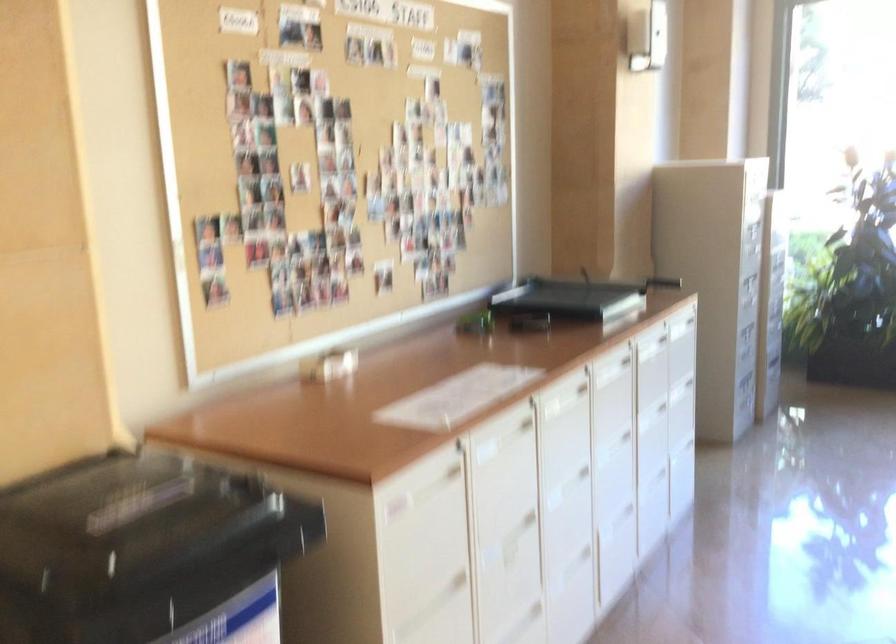
Image resolution: width=896 pixels, height=644 pixels. What do you see at coordinates (662, 281) in the screenshot?
I see `the paper cutter handle` at bounding box center [662, 281].